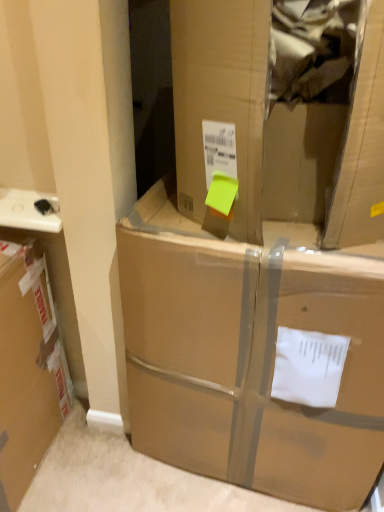
Question: From the image's perspective, is brown cardboard box at center beneath brown cardboard box at center?

Choices:
 (A) no
 (B) yes

Answer: (A)

Question: Is there a large distance between brown cardboard box at center and brown cardboard box at center?

Choices:
 (A) no
 (B) yes

Answer: (A)

Question: Is brown cardboard box at center located outside brown cardboard box at center?

Choices:
 (A) no
 (B) yes

Answer: (B)

Question: Is the surface of brown cardboard box at center in direct contact with brown cardboard box at center?

Choices:
 (A) no
 (B) yes

Answer: (A)

Question: Considering the relative sizes of brown cardboard box at center and brown cardboard box at center in the image provided, is brown cardboard box at center taller than brown cardboard box at center?

Choices:
 (A) no
 (B) yes

Answer: (A)

Question: Considering the relative sizes of brown cardboard box at center and brown cardboard box at center in the image provided, is brown cardboard box at center thinner than brown cardboard box at center?

Choices:
 (A) yes
 (B) no

Answer: (A)

Question: Can we say brown cardboard box at center lies outside brown cardboard box at center?

Choices:
 (A) no
 (B) yes

Answer: (B)

Question: Is brown cardboard box at center facing towards brown cardboard box at center?

Choices:
 (A) yes
 (B) no

Answer: (B)

Question: From a real-world perspective, is brown cardboard box at center positioned under brown cardboard box at center based on gravity?

Choices:
 (A) yes
 (B) no

Answer: (A)

Question: Is brown cardboard box at center far from brown cardboard box at center?

Choices:
 (A) yes
 (B) no

Answer: (B)

Question: Can you confirm if brown cardboard box at center is wider than brown cardboard box at center?

Choices:
 (A) yes
 (B) no

Answer: (A)

Question: From a real-world perspective, does brown cardboard box at center stand above brown cardboard box at center?

Choices:
 (A) yes
 (B) no

Answer: (B)

Question: From a real-world perspective, is brown cardboard box at center positioned above or below brown cardboard box at center?

Choices:
 (A) above
 (B) below

Answer: (B)